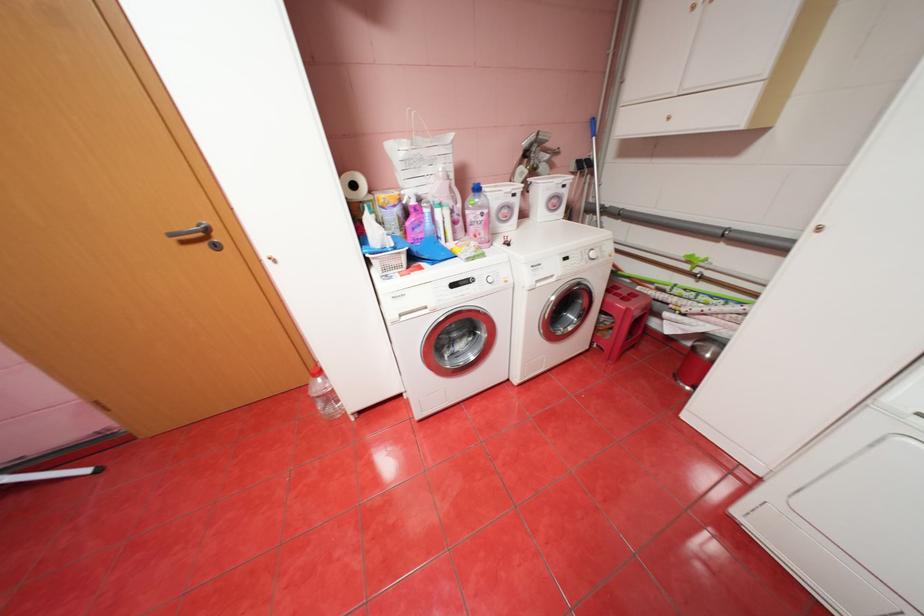
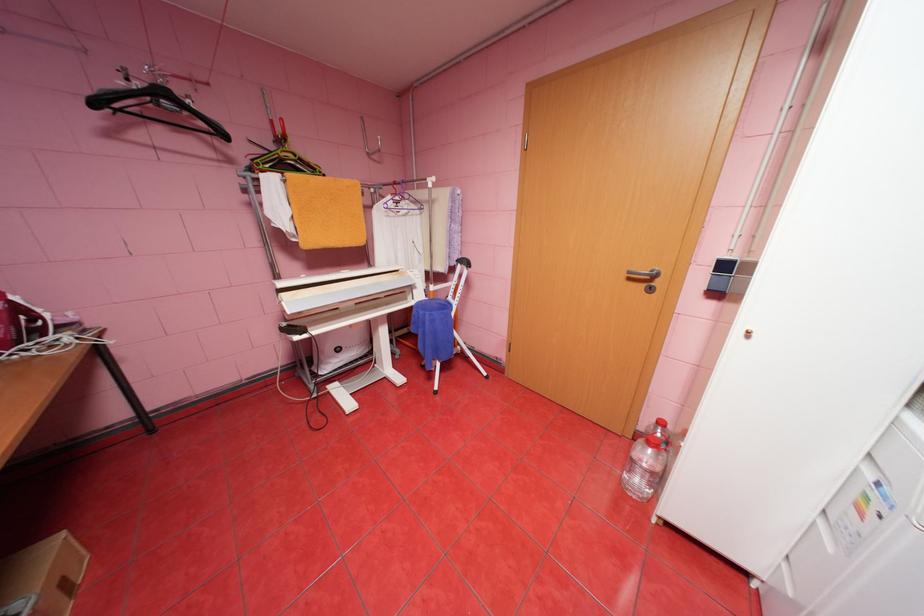
In the second image, find the point that corresponds to (x=329, y=379) in the first image.

(659, 451)